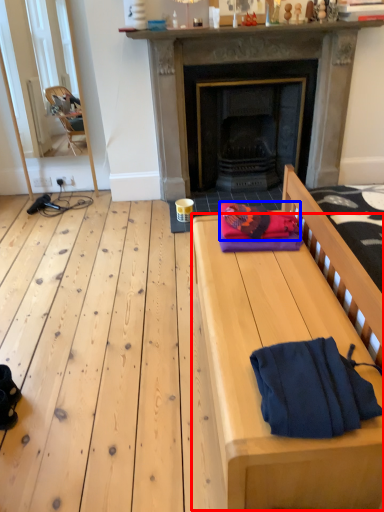
Question: Which point is further to the camera, table (highlighted by a red box) or blanket (highlighted by a blue box)?

Choices:
 (A) table
 (B) blanket

Answer: (B)